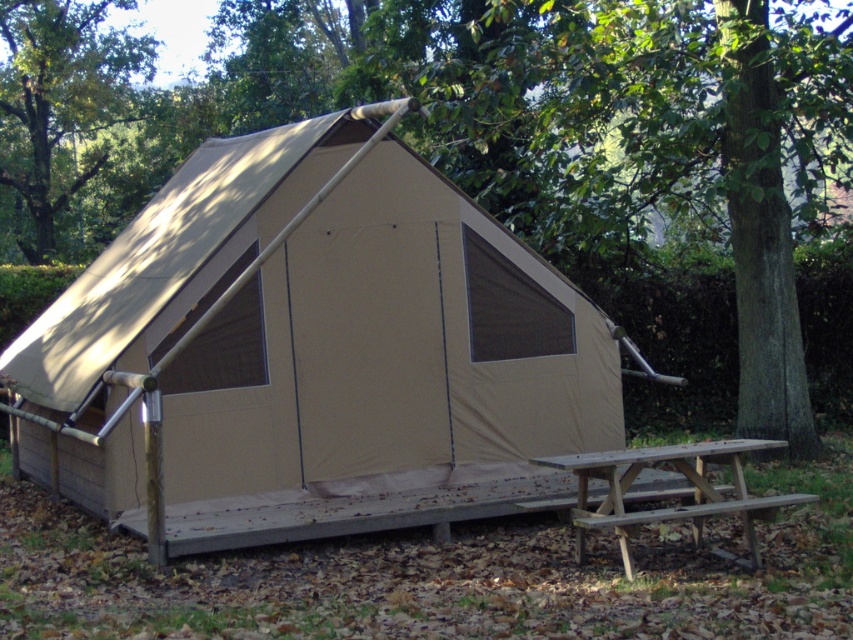
You are planning to take a photo of the green leafy tree at upper left and the wooden picnic table at lower right from a distance. Which object will appear bigger in the photo?

The green leafy tree at upper left will appear bigger in the photo since it is larger in size than the wooden picnic table at lower right.

You are setting up a small campsite and have a brown wooden bench at lower right and a wooden picnic table at lower center. Which object has a greater size?

The brown wooden bench at lower right is bigger than the wooden picnic table at lower center according to the description.